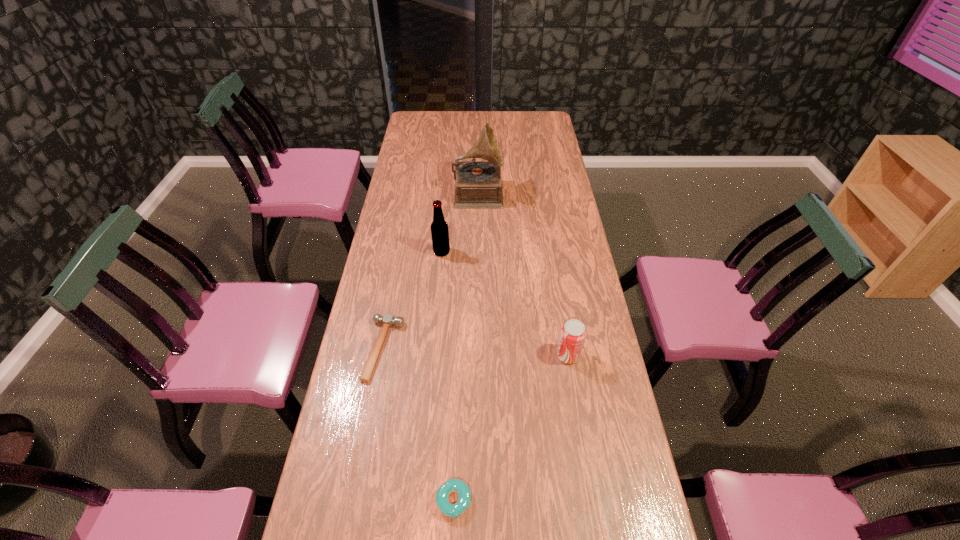
Locate an element on the screen. The height and width of the screenshot is (540, 960). vacant space located 0.050m on the logo side of the rightmost object is located at coordinates (540, 355).

Locate an element on the screen. vacant position located on the logo side of the rightmost object is located at coordinates (431, 355).

What are the coordinates of `free spot located on the logo side of the rightmost object` in the screenshot? It's located at (492, 355).

You are a GUI agent. You are given a task and a screenshot of the screen. Output one action in this format:
    pyautogui.click(x=<x>, y=<y>)
    Task: Click on the free space located on the right of the leftmost object
    
    Given the screenshot: What is the action you would take?
    pyautogui.click(x=465, y=349)

The width and height of the screenshot is (960, 540). I want to click on free region located on the right of the doughnut, so click(578, 501).

Where is `object present at the left edge`? This screenshot has height=540, width=960. object present at the left edge is located at coordinates (388, 320).

Locate an element on the screen. object that is at the right edge is located at coordinates (573, 333).

The width and height of the screenshot is (960, 540). What are the coordinates of `free point at the far edge` in the screenshot? It's located at (522, 120).

Locate an element on the screen. free space at the left edge of the desktop is located at coordinates (426, 177).

At what (x,y) coordinates should I click in order to perform the action: click on vacant space at the right edge of the desktop. Please return your answer as a coordinate pair (x, y). Looking at the image, I should click on (557, 187).